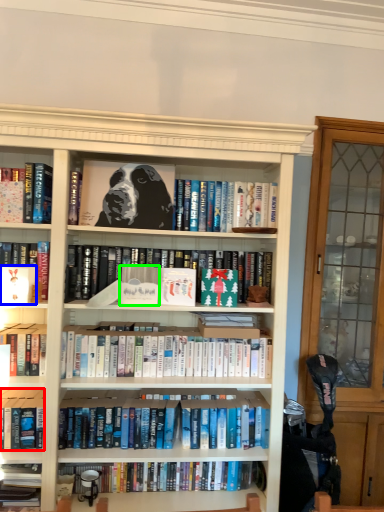
Question: Which object is positioned farthest from book (highlighted by a red box)? Select from paperback book (highlighted by a blue box) and paperback book (highlighted by a green box).

Choices:
 (A) paperback book
 (B) paperback book

Answer: (B)